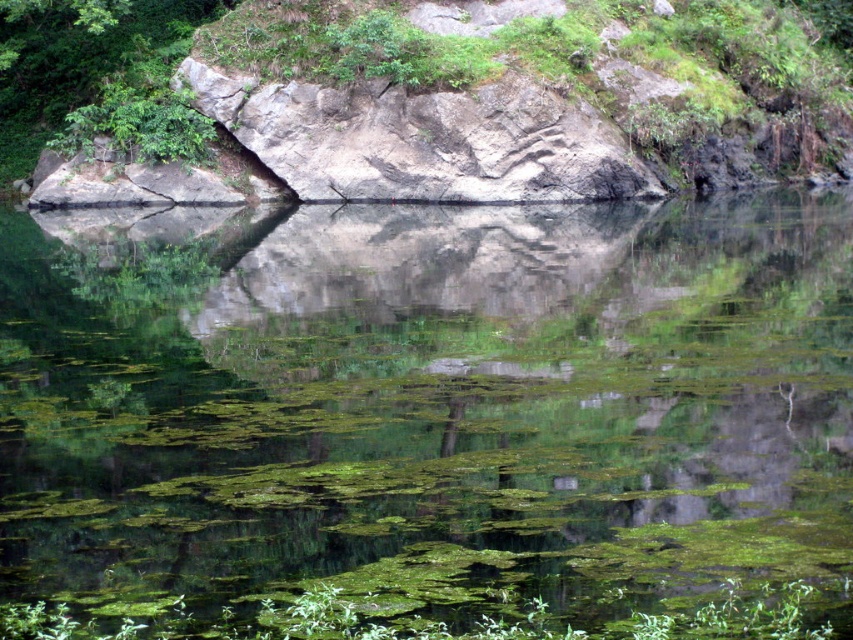
Question: Which object appears farthest from the camera in this image?

Choices:
 (A) gray rock at center
 (B) green algae-covered water at center

Answer: (A)

Question: Is green algae-covered water at center wider than gray rock at center?

Choices:
 (A) yes
 (B) no

Answer: (B)

Question: Is green algae-covered water at center wider than gray rock at center?

Choices:
 (A) no
 (B) yes

Answer: (A)

Question: Can you confirm if green algae-covered water at center is wider than gray rock at center?

Choices:
 (A) no
 (B) yes

Answer: (A)

Question: Which point is farther from the camera taking this photo?

Choices:
 (A) (341, 88)
 (B) (558, 403)

Answer: (A)